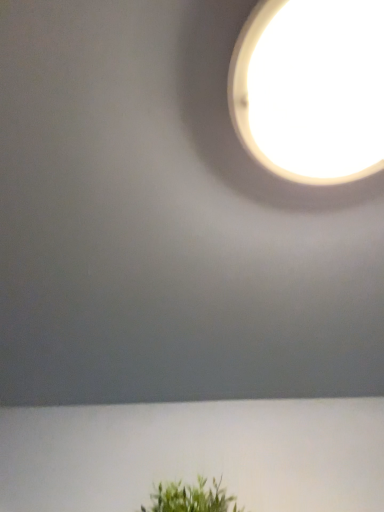
Question: Is green leafy plant at lower center in front of or behind white glossy lampshade at upper center in the image?

Choices:
 (A) front
 (B) behind

Answer: (B)

Question: Would you say green leafy plant at lower center is to the left or to the right of white glossy lampshade at upper center in the picture?

Choices:
 (A) right
 (B) left

Answer: (B)

Question: Do you think green leafy plant at lower center is within white glossy lampshade at upper center, or outside of it?

Choices:
 (A) outside
 (B) inside

Answer: (A)

Question: Is white glossy lampshade at upper center wider or thinner than green leafy plant at lower center?

Choices:
 (A) thin
 (B) wide

Answer: (B)

Question: Is white glossy lampshade at upper center bigger or smaller than green leafy plant at lower center?

Choices:
 (A) big
 (B) small

Answer: (B)

Question: From the image's perspective, relative to green leafy plant at lower center, is white glossy lampshade at upper center above or below?

Choices:
 (A) above
 (B) below

Answer: (A)

Question: Relative to green leafy plant at lower center, is white glossy lampshade at upper center in front or behind?

Choices:
 (A) behind
 (B) front

Answer: (B)